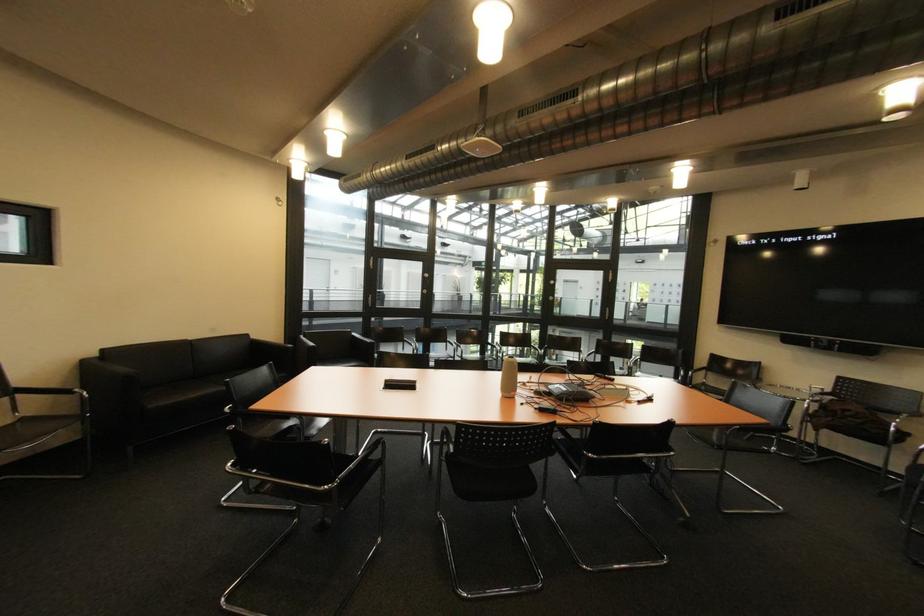
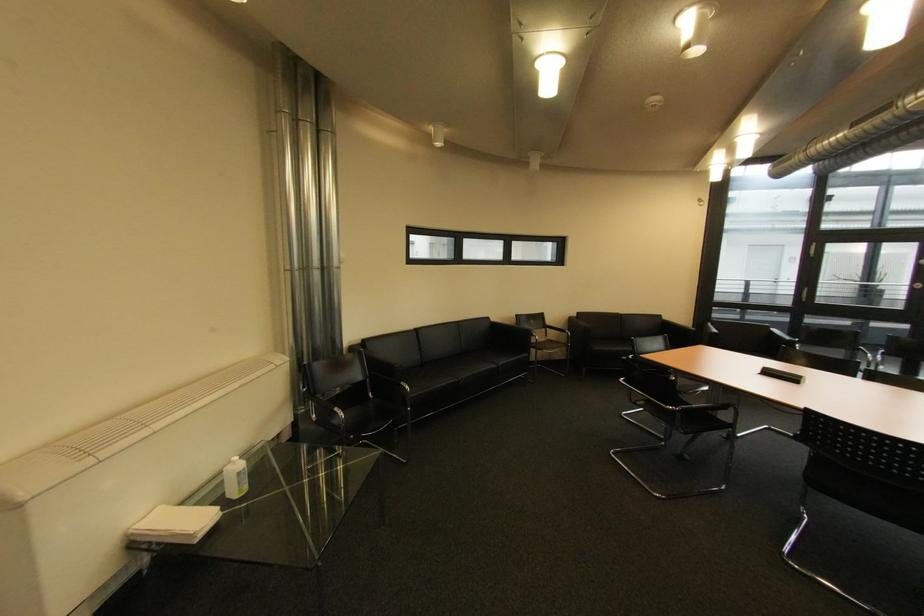
The point at (27,397) is marked in the first image. Where is the corresponding point in the second image?

(555, 330)